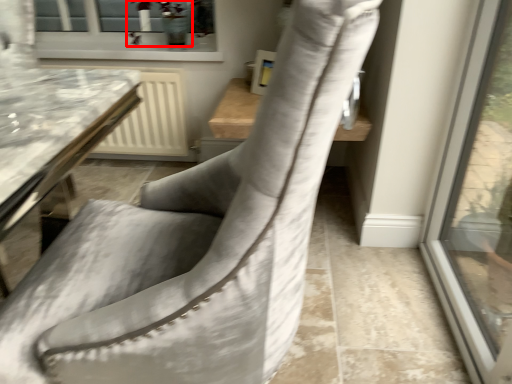
Question: Where is plant (annotated by the red box) located in relation to chair in the image?

Choices:
 (A) left
 (B) right

Answer: (A)